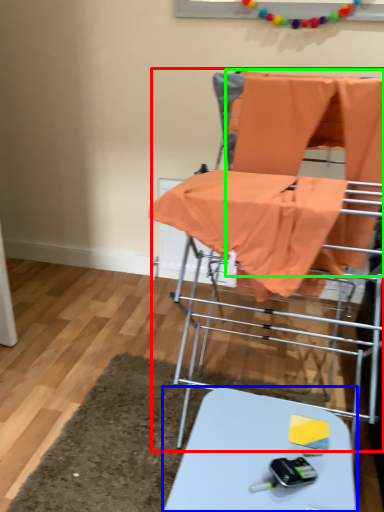
Question: Which object is the closest to the baby carriage (highlighted by a red box)? Choose among these: table (highlighted by a blue box) or fabric (highlighted by a green box).

Choices:
 (A) table
 (B) fabric

Answer: (B)